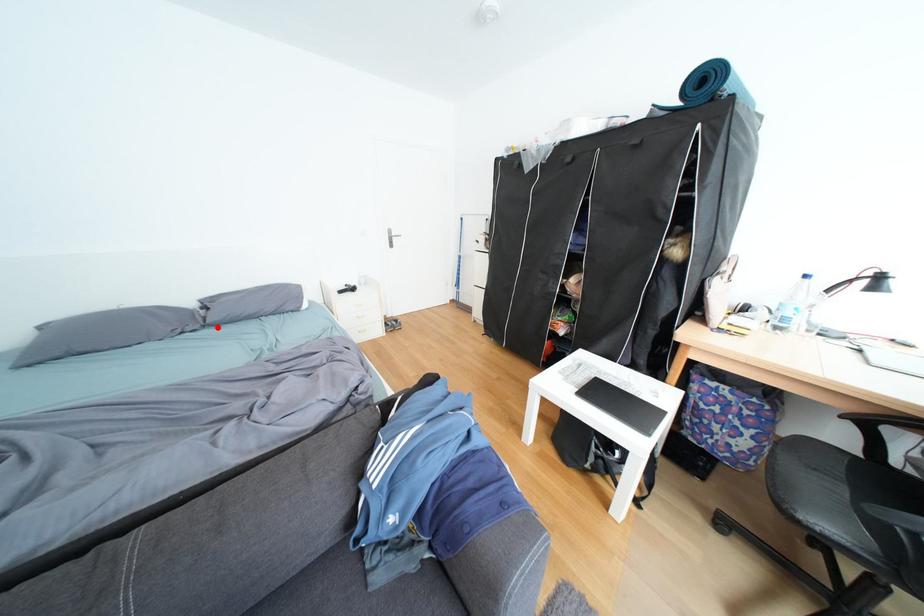
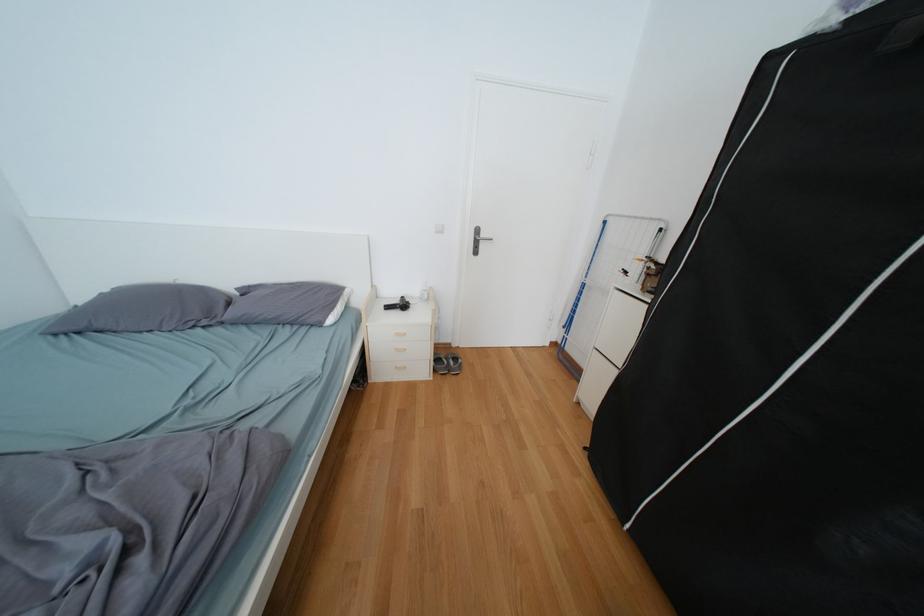
Locate, in the second image, the point that corresponds to the highlighted location in the first image.

(235, 323)